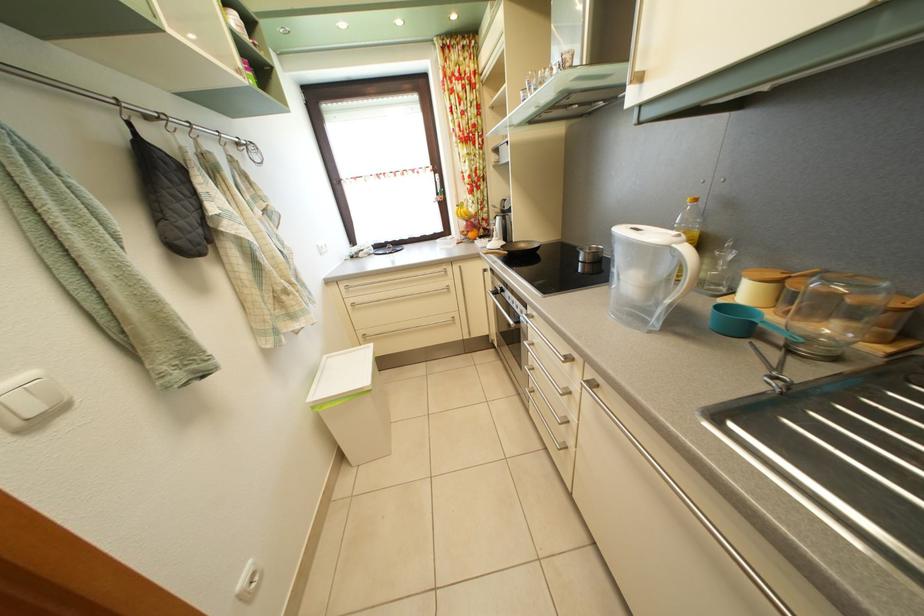
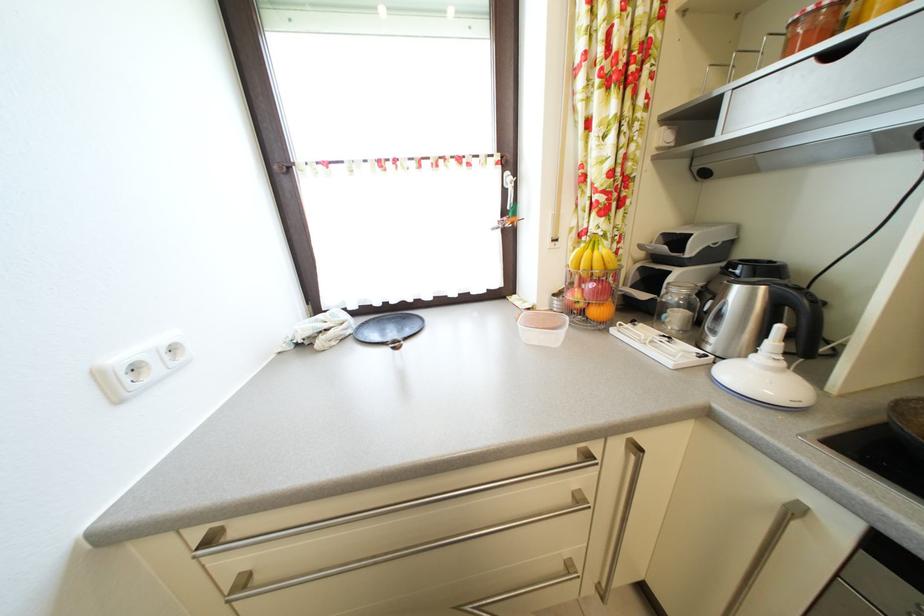
Question: In a continuous first-person perspective shot, in which direction is the camera moving?

Choices:
 (A) Left
 (B) Right
 (C) Forward
 (D) Backward

Answer: (C)